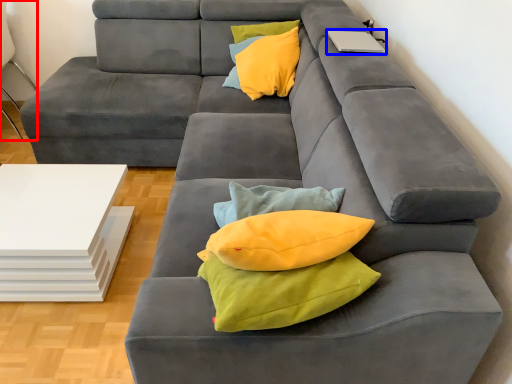
Question: Among these objects, which one is nearest to the camera, armchair (highlighted by a red box) or laptop (highlighted by a blue box)?

Choices:
 (A) armchair
 (B) laptop

Answer: (B)